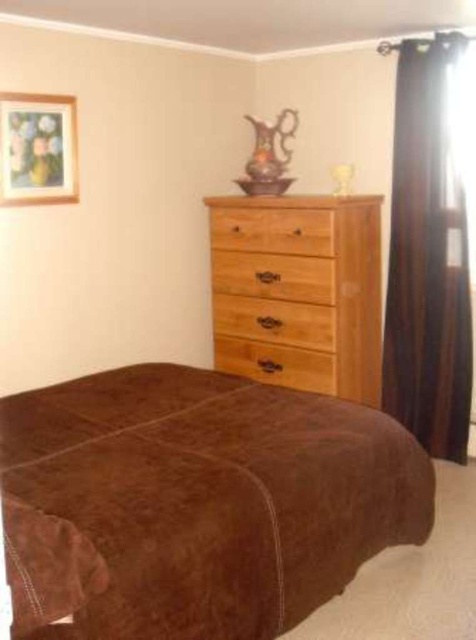
Question: Does light brown wood dresser at center come in front of light brown wood drawer at center?

Choices:
 (A) no
 (B) yes

Answer: (B)

Question: Can you confirm if natural wood drawer at center is positioned to the right of brown wood drawer at center?

Choices:
 (A) yes
 (B) no

Answer: (B)

Question: Does brown suede bed at center appear on the left side of light brown wood drawer at center?

Choices:
 (A) yes
 (B) no

Answer: (A)

Question: Which object appears closest to the camera in this image?

Choices:
 (A) brown wood drawer at center
 (B) light brown wood drawer at center
 (C) natural wood drawer at center
 (D) light brown wood dresser at center

Answer: (D)

Question: Which of the following is the closest to the observer?

Choices:
 (A) natural wood drawer at center
 (B) light brown wood dresser at center

Answer: (B)

Question: Considering the real-world distances, which object is closest to the brown wood drawer at center?

Choices:
 (A) natural wood drawer at center
 (B) light brown wood dresser at center
 (C) black velvet curtain at right

Answer: (A)